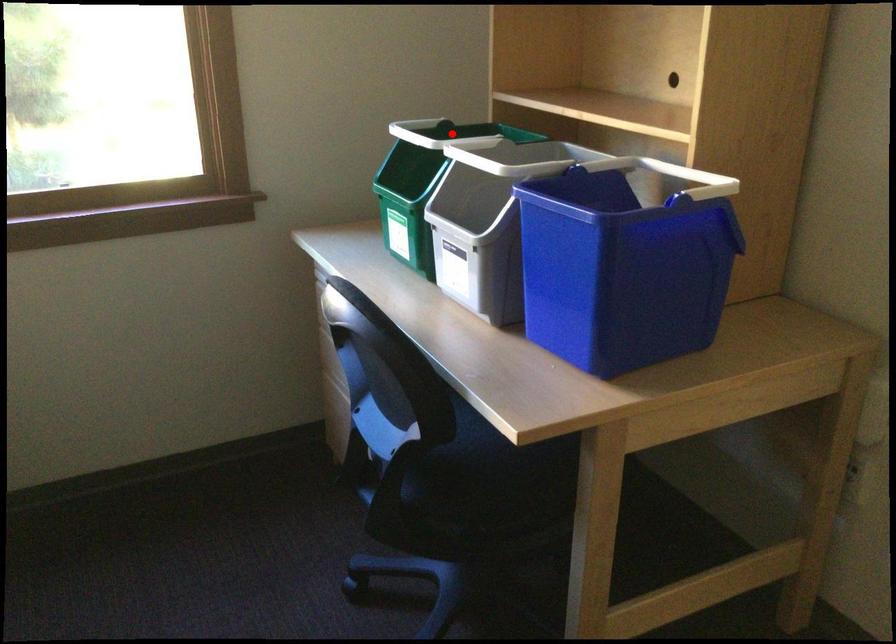
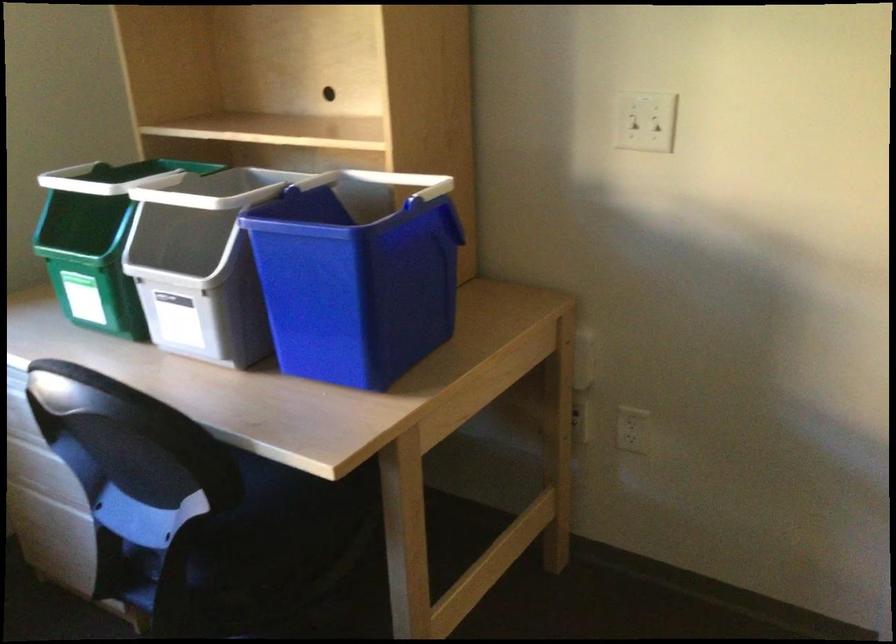
Question: I am providing you with two images of the same scene from different viewpoints. Image1 has a red point marked. In image2, the corresponding 3D location appears at what relative position? Reply with the corresponding letter.

Choices:
 (A) Closer
 (B) Farther

Answer: (A)